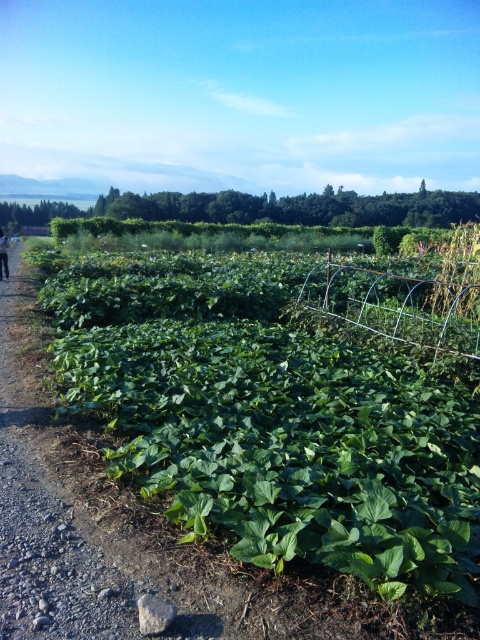
Question: Which of the following is the closest to the observer?

Choices:
 (A) green leafy plant at center
 (B) black fabric at left

Answer: (A)

Question: Does green leafy plant at center have a lesser width compared to black fabric at left?

Choices:
 (A) no
 (B) yes

Answer: (B)

Question: Among these objects, which one is farthest from the camera?

Choices:
 (A) black fabric at left
 (B) green leafy plant at center

Answer: (A)

Question: Is green leafy plant at center thinner than black fabric at left?

Choices:
 (A) yes
 (B) no

Answer: (A)

Question: Which object appears farthest from the camera in this image?

Choices:
 (A) black fabric at left
 (B) green leafy plant at center

Answer: (A)

Question: Is green leafy plant at center below black fabric at left?

Choices:
 (A) yes
 (B) no

Answer: (A)